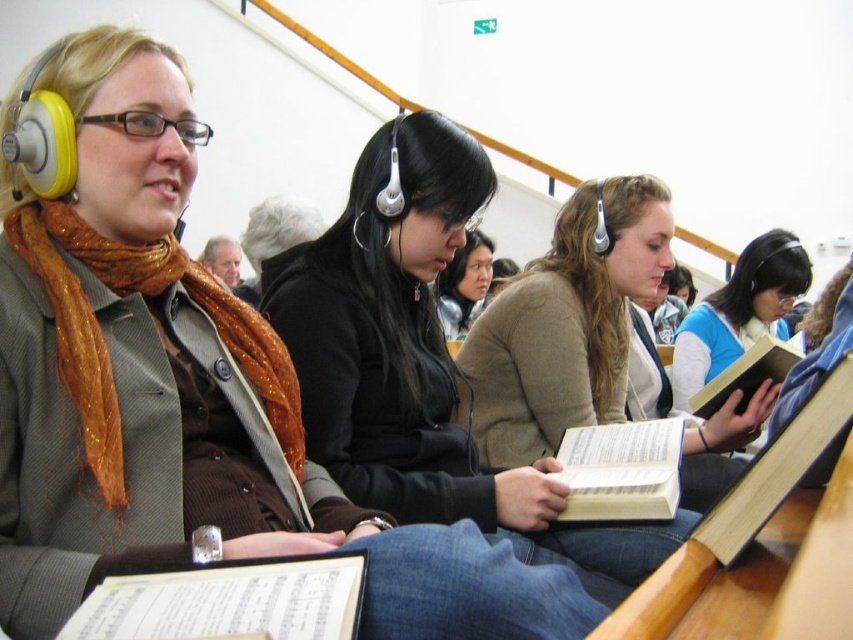
Based on the photo, you are an observer sitting at the back of the classroom. You notice a blue matte shirt at center and a white paper book at center. Which object is closer to you?

The blue matte shirt at center is positioned over the white paper book at center, so the blue matte shirt at center is closer to you.

Based on the scene description, which object is positioned to the right of the other? The blue matte shirt at center or the white paper book at center?

The blue matte shirt at center is to the right of the white paper book at center.

In the classroom scene, there are two items at center position. The blue matte shirt at center and the hardcover book at center. Which one is positioned to the right?

The blue matte shirt at center is to the right of the hardcover book at center.